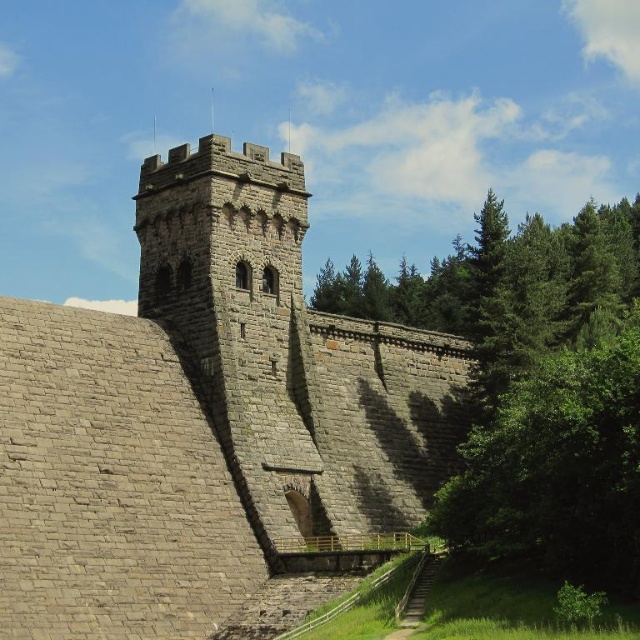
Question: Is gray stone castle at center bigger than green leafy tree at lower right?

Choices:
 (A) no
 (B) yes

Answer: (A)

Question: Where is gray stone castle at center located in relation to green leafy tree at lower right in the image?

Choices:
 (A) above
 (B) below

Answer: (B)

Question: Which object is closer to the camera taking this photo?

Choices:
 (A) green leafy tree at lower right
 (B) gray stone castle at center

Answer: (B)

Question: Observing the image, what is the correct spatial positioning of gray stone castle at center in reference to green leafy tree at lower right?

Choices:
 (A) right
 (B) left

Answer: (B)

Question: Which point is farther to the camera?

Choices:
 (A) (461, 260)
 (B) (6, 612)

Answer: (A)